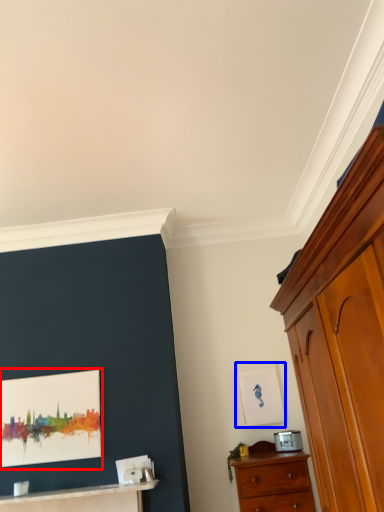
Question: Which object is closer to the camera taking this photo, picture frame (highlighted by a red box) or picture frame (highlighted by a blue box)?

Choices:
 (A) picture frame
 (B) picture frame

Answer: (A)